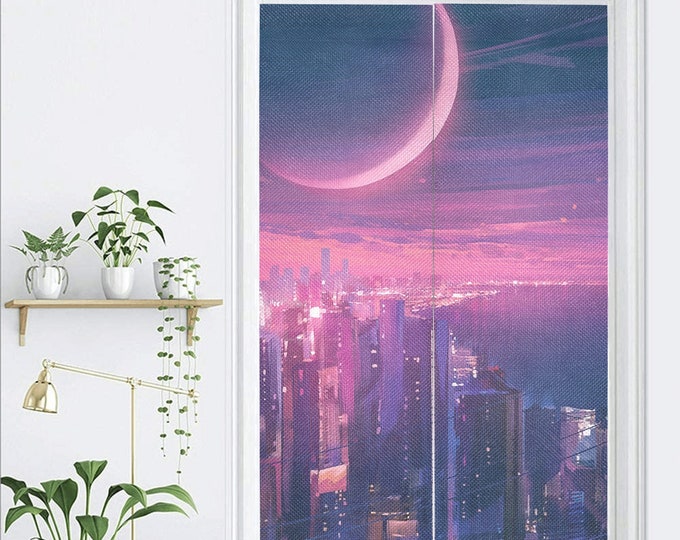
Find the location of a particular element. wooden shelf brackets is located at coordinates (24, 324), (188, 324).